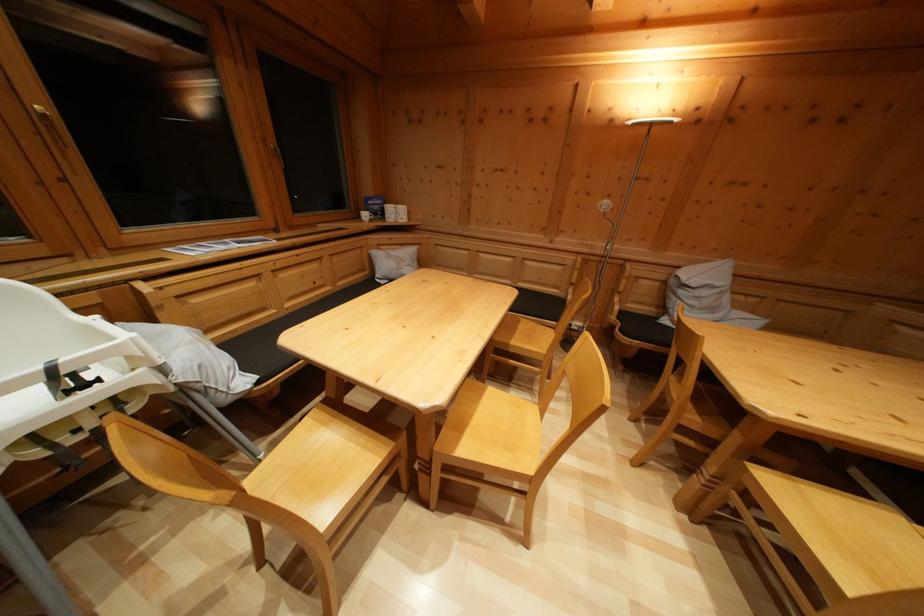
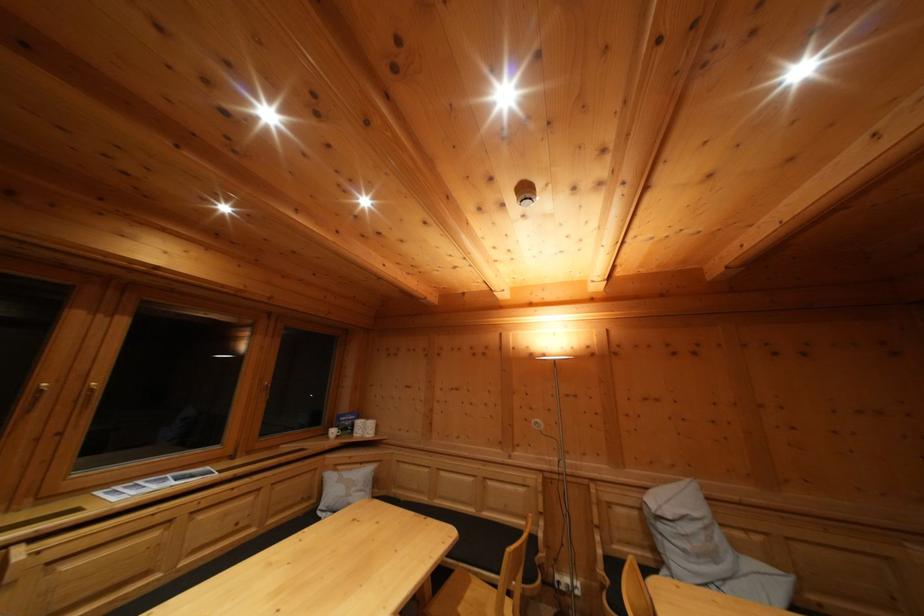
Find the pixel in the second image that matches point (563, 294) in the first image.

(532, 525)